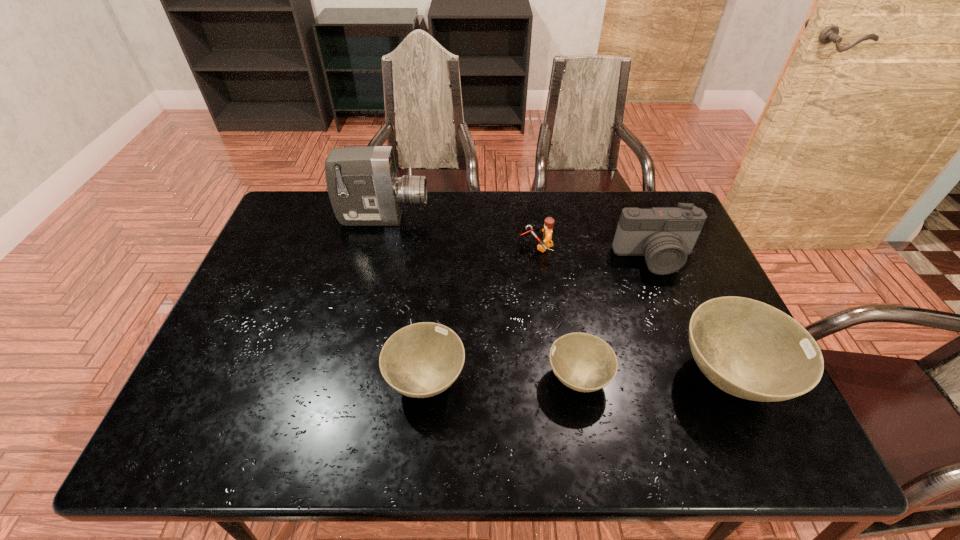
Find the location of `camera present at the right edge`. camera present at the right edge is located at coordinates (665, 236).

The image size is (960, 540). I want to click on object located in the near right corner section of the desktop, so click(749, 349).

Identify the location of vacant space at the far edge of the desktop. The image size is (960, 540). (435, 228).

In the image, there is a desktop. Where is `vacant region at the left edge`? This screenshot has width=960, height=540. vacant region at the left edge is located at coordinates (297, 257).

Locate an element on the screen. This screenshot has height=540, width=960. vacant space at the right edge is located at coordinates (658, 280).

Identify the location of vacant space at the far left corner. (328, 216).

Find the location of a particular element. This screenshot has height=540, width=960. free spot at the far right corner of the desktop is located at coordinates (665, 201).

Locate an element on the screen. Image resolution: width=960 pixels, height=540 pixels. unoccupied position between the Lego and the shortest object is located at coordinates (557, 313).

Find the location of a particular element. This screenshot has height=540, width=960. vacant space in between the camera and the Lego is located at coordinates (595, 252).

At what (x,y) coordinates should I click in order to perform the action: click on vacant space that's between the second tallest bowl and the tallest object. Please return your answer as a coordinate pair (x, y). Looking at the image, I should click on (405, 299).